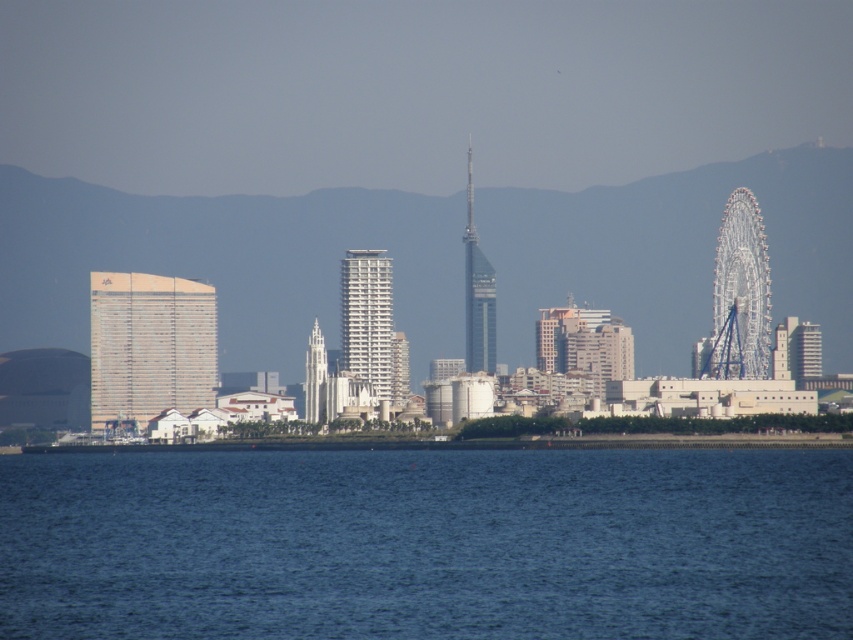
Question: Does blue liquid water at lower center appear over gold metallic building at left?

Choices:
 (A) yes
 (B) no

Answer: (B)

Question: Which object is farther from the camera taking this photo?

Choices:
 (A) metallic glass tower at center
 (B) white stone tower at center

Answer: (B)

Question: Estimate the real-world distances between objects in this image. Which object is farther from the white glossy building at center?

Choices:
 (A) white metallic ferris wheel at right
 (B) blue liquid water at lower center

Answer: (A)

Question: Does white glossy building at center come behind metallic glass tower at center?

Choices:
 (A) no
 (B) yes

Answer: (A)

Question: Among these points, which one is nearest to the camera?

Choices:
 (A) (323, 385)
 (B) (466, 260)
 (C) (387, 362)

Answer: (B)

Question: Considering the relative positions of gold metallic building at left and metallic glass tower at center in the image provided, where is gold metallic building at left located with respect to metallic glass tower at center?

Choices:
 (A) above
 (B) below

Answer: (B)